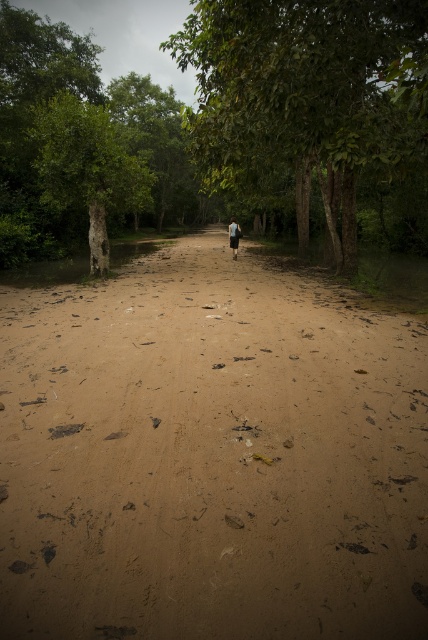
You are a hiker who wants to cross the path safely. You have a dark blue fabric at center and a brown sandy dirt track at center in front of you. Which object should you step on to avoid getting your shoes wet?

You should step on the brown sandy dirt track at center because it is to the left of the dark blue fabric at center, and the dark blue fabric at center might be covering a wet area or puddle on the path.

You are a hiker carrying a 10 feet long tent pole. You are standing on the brown sandy dirt track at center and want to reach the green matte tree at left. Can you lay the tent pole flat on the ground between them without bending it?

The distance between the brown sandy dirt track at center and the green matte tree at left is 23.18 feet, which is longer than the tent pole. Therefore, the tent pole cannot be laid flat between them without bending it.

In the scene shown: You are standing at the starting point of the dirt path in the forest scene. You want to walk towards the green leafy tree at center. What direction should you head in from your current position?

The green leafy tree at center is located at point 0.153 on the x axis and 0.717 on the y axis. Since you are at the starting point of the dirt path, which is likely at the lower left corner of the image, you should head towards the upper right direction to reach the green leafy tree at center.